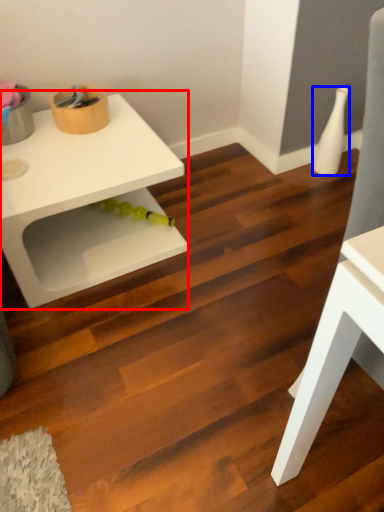
Question: Among these objects, which one is farthest to the camera, table (highlighted by a red box) or vase (highlighted by a blue box)?

Choices:
 (A) table
 (B) vase

Answer: (B)